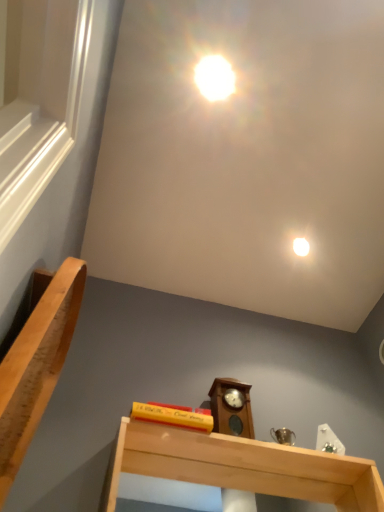
Question: Is light brown wood handrail at left inside or outside of light wood shelf at lower center?

Choices:
 (A) inside
 (B) outside

Answer: (B)

Question: In terms of width, does light brown wood handrail at left look wider or thinner when compared to light wood shelf at lower center?

Choices:
 (A) thin
 (B) wide

Answer: (A)

Question: Which object is the closest to the light wood shelf at lower center?

Choices:
 (A) white glossy droplight at upper center
 (B) wooden grandfather clock at center
 (C) light brown wood handrail at left

Answer: (B)

Question: Considering the real-world distances, which object is closest to the wooden grandfather clock at center?

Choices:
 (A) white glossy droplight at upper center
 (B) light wood shelf at lower center
 (C) light brown wood handrail at left

Answer: (B)